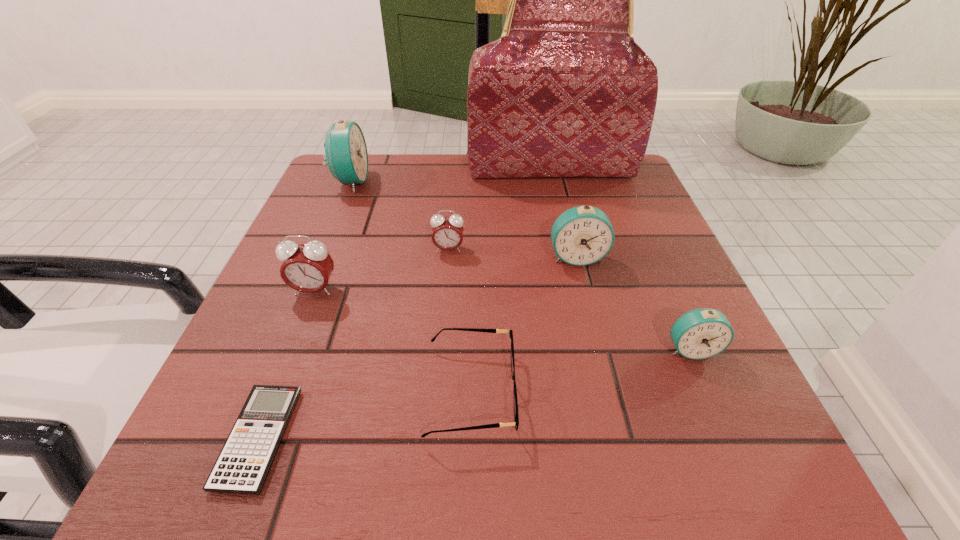
Where is `handbag`? handbag is located at coordinates (565, 91).

The height and width of the screenshot is (540, 960). I want to click on the farthest alarm clock, so click(346, 154).

Find the location of a particular element. This screenshot has height=540, width=960. the farthest blue alarm clock is located at coordinates (346, 154).

Locate an element on the screen. The height and width of the screenshot is (540, 960). the nearer pink alarm clock is located at coordinates (307, 268).

You are a GUI agent. You are given a task and a screenshot of the screen. Output one action in this format:
    pyautogui.click(x=<x>, y=<y>)
    Task: Click on the bigger pink alarm clock
    The image size is (960, 540).
    Given the screenshot: What is the action you would take?
    pyautogui.click(x=307, y=268)

Find the location of a particular element. the second biggest blue alarm clock is located at coordinates (582, 235).

This screenshot has width=960, height=540. Find the location of `the second blue alarm clock from left to right`. the second blue alarm clock from left to right is located at coordinates (582, 235).

Find the location of a particular element. The width and height of the screenshot is (960, 540). the third alarm clock from left to right is located at coordinates (447, 234).

Identify the location of the right pink alarm clock. The image size is (960, 540). (447, 234).

Identify the location of the smallest blue alarm clock. The height and width of the screenshot is (540, 960). (702, 333).